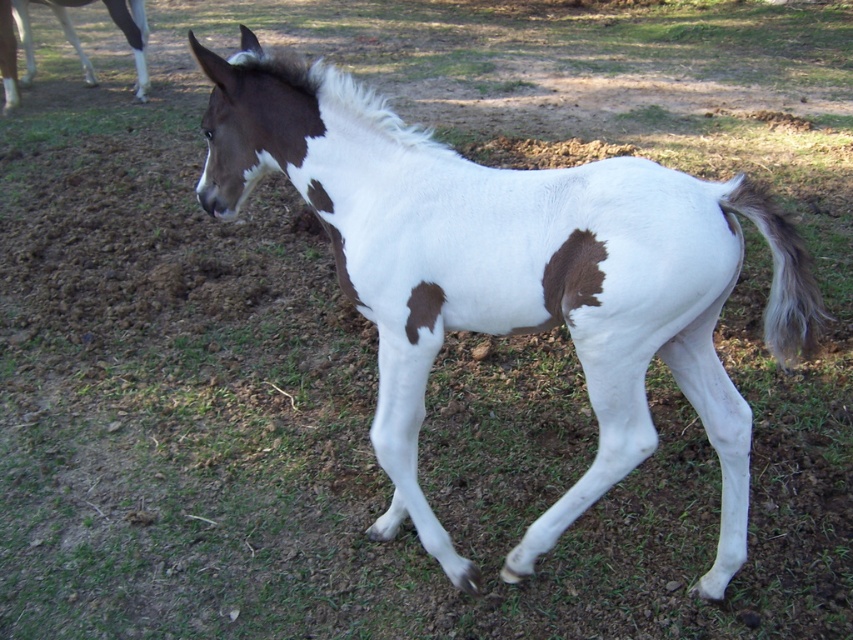
Question: Can you confirm if white silky tail at right is positioned to the left of brown fuzzy patch at lower right?

Choices:
 (A) yes
 (B) no

Answer: (B)

Question: Which point appears closest to the camera in this image?

Choices:
 (A) (773, 208)
 (B) (142, 1)
 (C) (204, 179)

Answer: (A)

Question: Does white silky tail at right have a smaller size compared to brown fuzzy patch at lower right?

Choices:
 (A) no
 (B) yes

Answer: (A)

Question: Can you confirm if white silky tail at right is positioned below white glossy leg at upper left?

Choices:
 (A) yes
 (B) no

Answer: (A)

Question: Which point appears closest to the camera in this image?

Choices:
 (A) (479, 188)
 (B) (3, 13)
 (C) (575, 268)

Answer: (C)

Question: Which object is farther from the camera taking this photo?

Choices:
 (A) brown fuzzy patch at lower right
 (B) white glossy leg at upper left
 (C) white silky tail at right

Answer: (B)